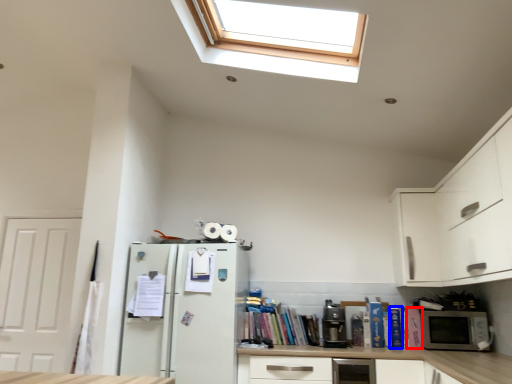
Question: Which object is further to the camera taking this photo, book (highlighted by a red box) or book (highlighted by a blue box)?

Choices:
 (A) book
 (B) book

Answer: (B)